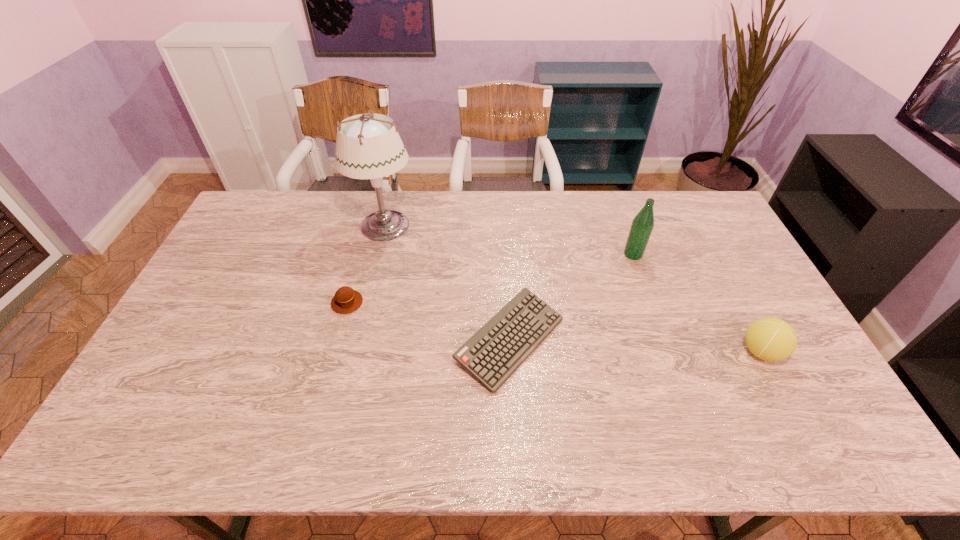
Locate an element on the screen. the tallest object is located at coordinates (370, 148).

The width and height of the screenshot is (960, 540). Identify the location of the second object from right to left. [x=642, y=225].

Find the location of a particular element. the fourth shortest object is located at coordinates (642, 225).

Identify the location of the third shortest object. This screenshot has height=540, width=960. (771, 339).

Find the location of a particular element. tennis ball is located at coordinates (771, 339).

The image size is (960, 540). I want to click on muffin, so click(x=346, y=300).

Where is `computer keyboard`? computer keyboard is located at coordinates (497, 349).

Image resolution: width=960 pixels, height=540 pixels. What are the coordinates of `the third object from right to left` in the screenshot? It's located at (497, 349).

Locate an element on the screen. The image size is (960, 540). vacant space located 0.140m on the lampshade of the lampshade is located at coordinates (456, 227).

Where is `free location located 0.240m on the back of the fourth object from left to right`? This screenshot has height=540, width=960. free location located 0.240m on the back of the fourth object from left to right is located at coordinates (615, 205).